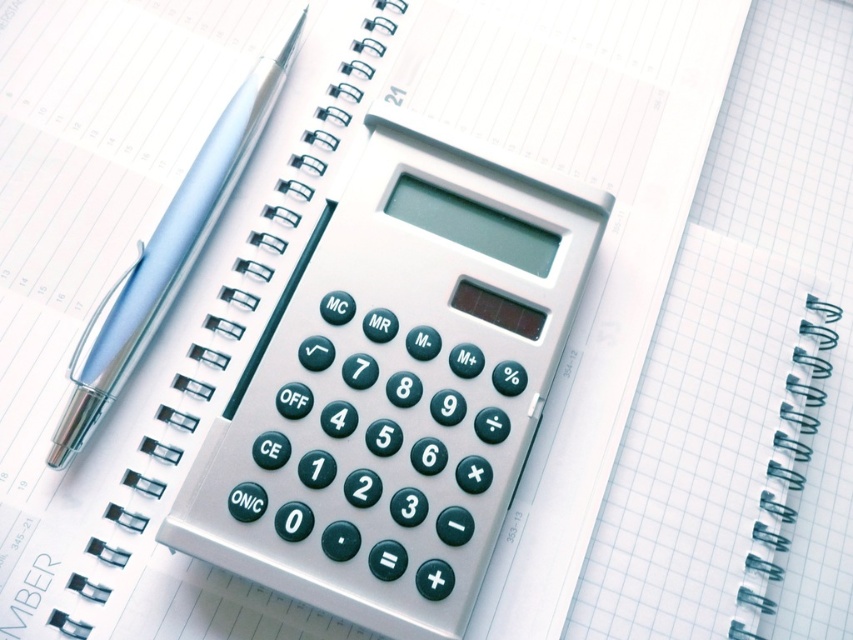
Who is taller, silver/black calculator at center or silver metallic pen at left?

silver/black calculator at center is taller.

Who is more distant from viewer, (302, 572) or (225, 136)?

The point (225, 136) is behind.

Find the location of a particular element. silver/black calculator at center is located at coordinates (396, 385).